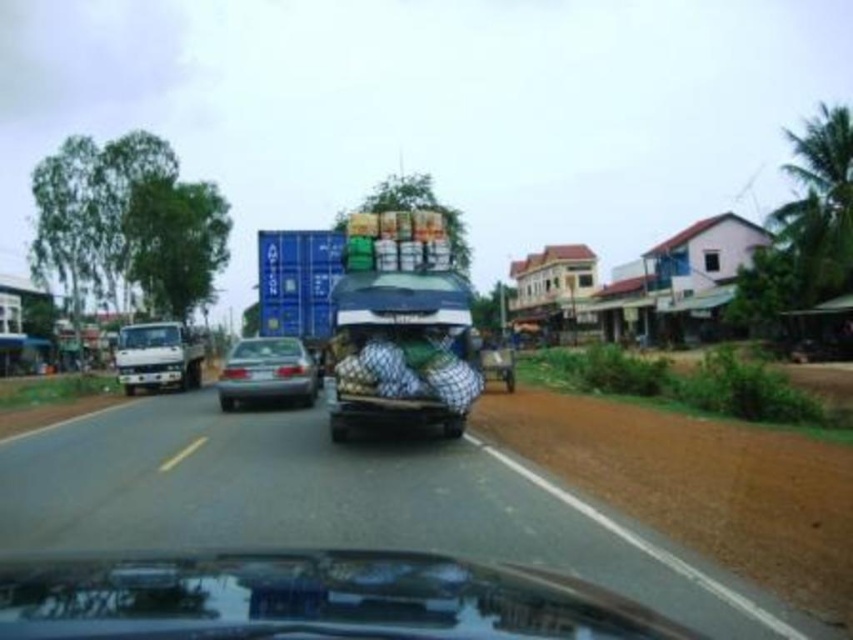
You are a passenger in the vehicle and notice two points marked on the road ahead. The first point is at coordinates point (219, 394) and the second is at point (511, 381). From your perspective, which point is closer to the vehicle?

Point (219, 394) is in front of point (511, 381), so it is closer to the vehicle.

In the scene shown: You are a passenger in the vehicle and notice two objects at the center of the road ahead. The glossy black car at center and the wooden cart at center. Which one is closer to you?

The glossy black car at center is closer to you because it is located below the wooden cart at center, indicating it is in a lower position in the visual field, which typically corresponds to being nearer in such a perspective.

You are a passenger in the vehicle and notice two objects at the center of the scene. Which object is closer to you, the satin silver sedan at center or the wooden cart at center?

The satin silver sedan at center is positioned under the wooden cart at center, so the wooden cart at center is closer to you.